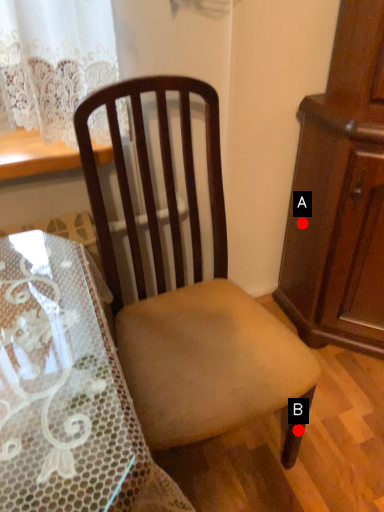
Question: Two points are circled on the image, labeled by A and B beside each circle. Which point is closer to the camera?

Choices:
 (A) A is closer
 (B) B is closer

Answer: (B)